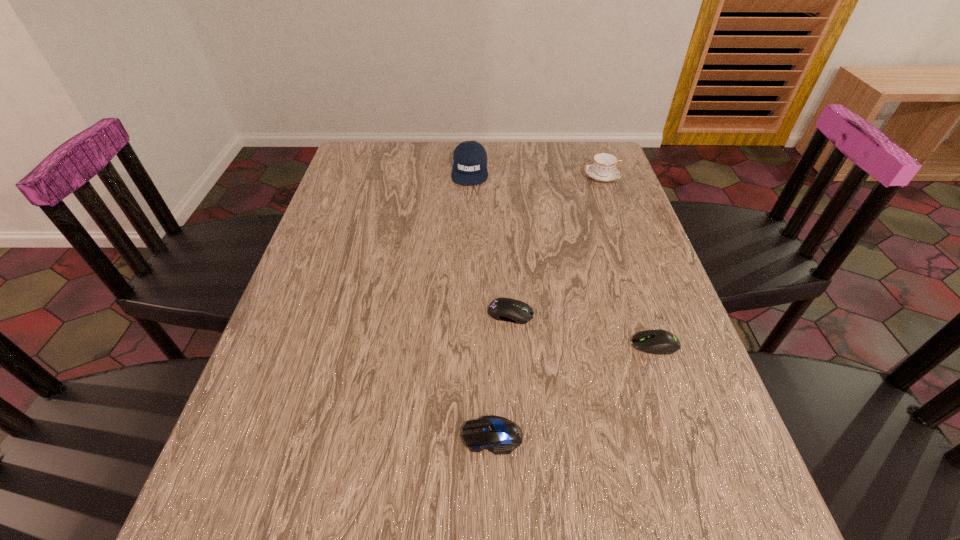
The height and width of the screenshot is (540, 960). Find the location of `vacant region at the near edge of the desktop`. vacant region at the near edge of the desktop is located at coordinates (470, 526).

Locate an element on the screen. Image resolution: width=960 pixels, height=540 pixels. vacant point at the left edge is located at coordinates (356, 195).

What are the coordinates of `vacant space at the right edge of the desktop` in the screenshot? It's located at (623, 261).

Find the location of a particular element. The image size is (960, 540). vacant space at the far right corner of the desktop is located at coordinates tap(592, 145).

This screenshot has width=960, height=540. In order to click on vacant space that is in between the nearest computer mouse and the baseball cap in this screenshot , I will do `click(481, 302)`.

The width and height of the screenshot is (960, 540). I want to click on vacant region between the second tallest object and the second nearest object, so click(x=629, y=260).

At what (x,y) coordinates should I click in order to perform the action: click on vacant space that is in between the nearest computer mouse and the fourth farthest object. Please return your answer as a coordinate pair (x, y). This screenshot has width=960, height=540. Looking at the image, I should click on (574, 390).

Where is `free space that is in between the second tallest object and the farthest computer mouse`? free space that is in between the second tallest object and the farthest computer mouse is located at coordinates (556, 245).

Locate an element on the screen. The width and height of the screenshot is (960, 540). free space between the farthest computer mouse and the nearest object is located at coordinates (501, 374).

Identify the location of free space that is in between the baseball cap and the nearest computer mouse. Image resolution: width=960 pixels, height=540 pixels. (481, 302).